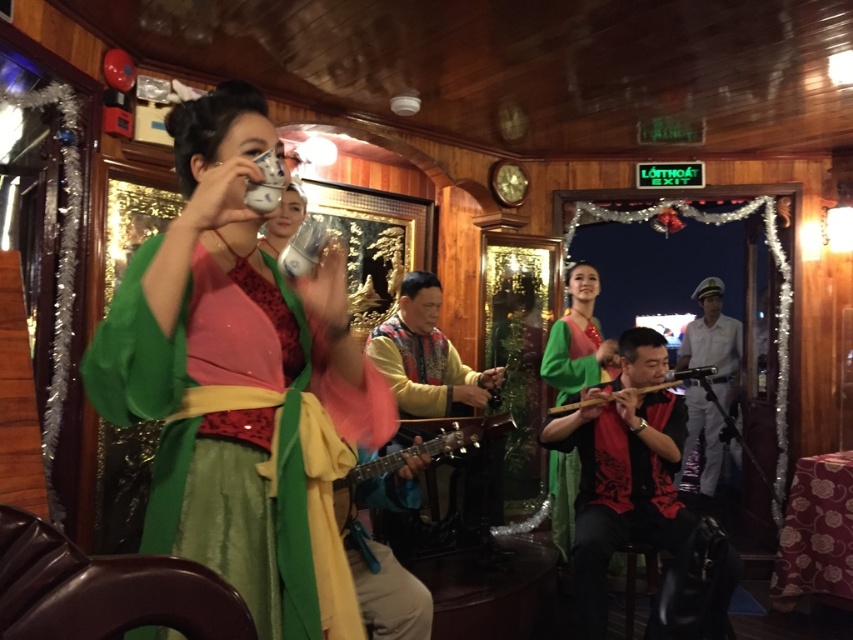
Question: Does red velvet flute at center appear on the left side of green satin dress at center?

Choices:
 (A) no
 (B) yes

Answer: (A)

Question: Does red velvet flute at center have a greater width compared to multicolored fabric guitar at center?

Choices:
 (A) yes
 (B) no

Answer: (A)

Question: Can you confirm if red velvet flute at center is positioned below wooden flute at center?

Choices:
 (A) no
 (B) yes

Answer: (B)

Question: Among these objects, which one is farthest from the camera?

Choices:
 (A) wooden acoustic guitar at center
 (B) green silk dress at center
 (C) white uniform at center
 (D) green satin dress at center

Answer: (C)

Question: Which of the following is the farthest from the observer?

Choices:
 (A) (666, 403)
 (B) (509, 426)
 (C) (602, 376)

Answer: (C)

Question: Among these points, which one is farthest from the camera?

Choices:
 (A) (718, 417)
 (B) (567, 508)
 (C) (602, 456)
 (D) (172, 392)

Answer: (A)